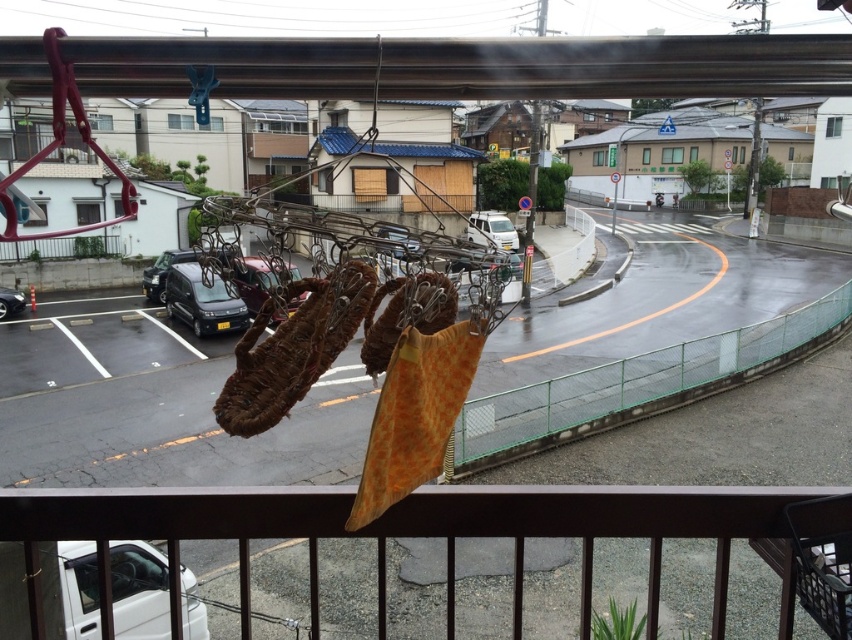
You are a delivery driver who needs to park your vehicle between the white matte van at center and the shiny silver car at center. Considering their heights, which vehicle should you park closer to in order to avoid hitting the clothesline hanging above the street?

The white matte van at center is much taller than the shiny silver car at center. To avoid hitting the clothesline, you should park closer to the shiny silver car at center since it is shorter and less likely to interfere with the hanging clothesline.